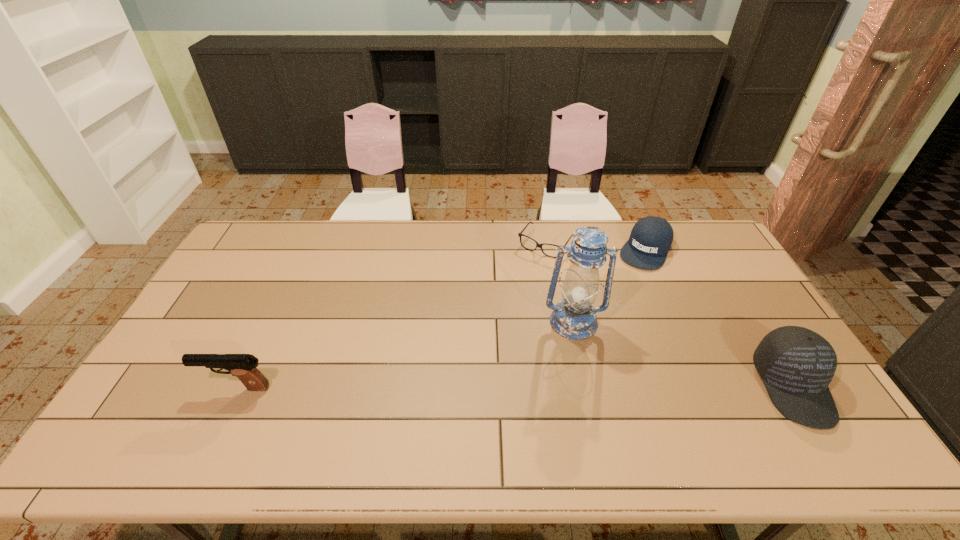
Find the location of a particular element. The image size is (960, 540). object that is the closest to the shorter baseball cap is located at coordinates (520, 234).

Locate an element on the screen. This screenshot has height=540, width=960. free spot that satisfies the following two spatial constraints: 1. on the front side of the third nearest object; 2. on the left side of the shortest object is located at coordinates (560, 322).

Find the location of a particular element. Image resolution: width=960 pixels, height=540 pixels. free location that satisfies the following two spatial constraints: 1. on the front side of the spectacles; 2. on the left side of the lantern is located at coordinates 560,322.